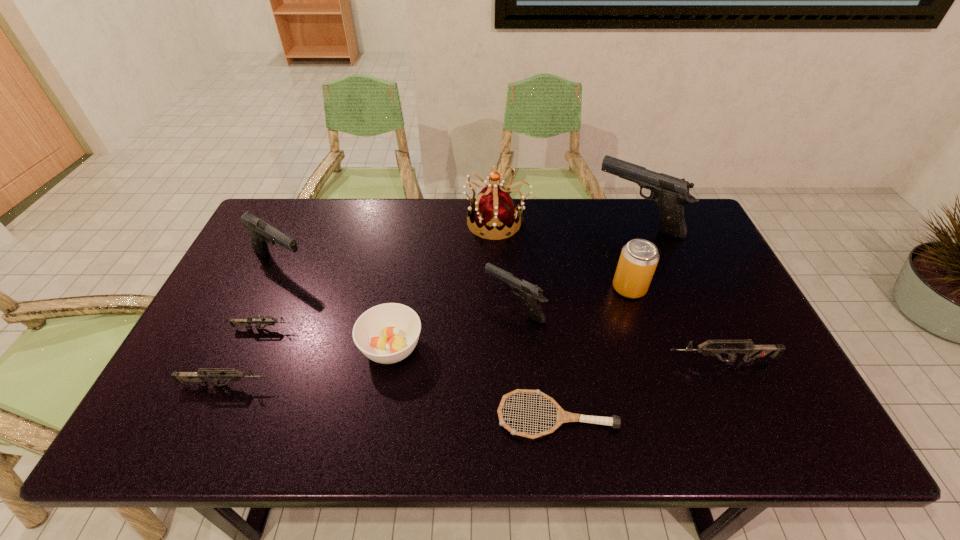
Where is `blank space located 0.130m aimed along the barrel of the biggest grey gun`? Image resolution: width=960 pixels, height=540 pixels. blank space located 0.130m aimed along the barrel of the biggest grey gun is located at coordinates (613, 361).

Locate an element on the screen. free space located on the back of the fourth object from left to right is located at coordinates (409, 249).

The width and height of the screenshot is (960, 540). I want to click on vacant space located 0.280m aimed along the barrel of the nearest grey gun, so click(x=390, y=385).

Where is `free space located 0.250m aimed along the barrel of the fourth farthest gun`? free space located 0.250m aimed along the barrel of the fourth farthest gun is located at coordinates (390, 329).

Find the location of `free region located 0.310m on the back of the shortest object`. free region located 0.310m on the back of the shortest object is located at coordinates (540, 296).

I want to click on tiara that is at the far edge, so click(494, 209).

Find the location of a particular element. The image size is (960, 540). gun located at the far edge is located at coordinates (670, 193).

This screenshot has width=960, height=540. In order to click on object present at the near edge in this screenshot , I will do `click(563, 416)`.

Locate an element on the screen. This screenshot has width=960, height=540. object that is at the far right corner is located at coordinates (670, 193).

Locate an element on the screen. vacant space at the far edge of the desktop is located at coordinates (570, 217).